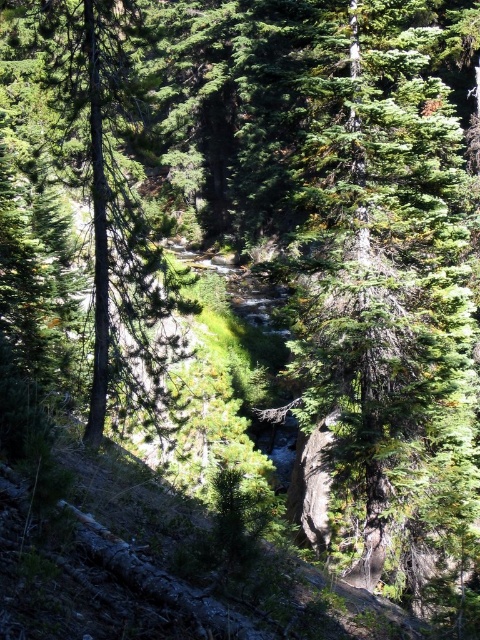
Based on the coordinates provided, which object is located at point (384,300) in the forest scene?

The point (384,300) corresponds to the green textured tree at center.

You are hiking in the forest and notice two trees at the center of the image. The first is labeled as the green textured tree at center, and the second is the green rough bark tree at center. Which of these two trees is taller?

The green rough bark tree at center is taller than the green textured tree at center.

You are a hiker trying to cross the stream in the forest. You see two trees at the center of the image, the green textured tree at center and the green rough bark tree at center. Which tree has a narrower width, making it easier to navigate around while crossing the stream?

The green textured tree at center has a narrower width than the green rough bark tree at center, making it easier to navigate around while crossing the stream.